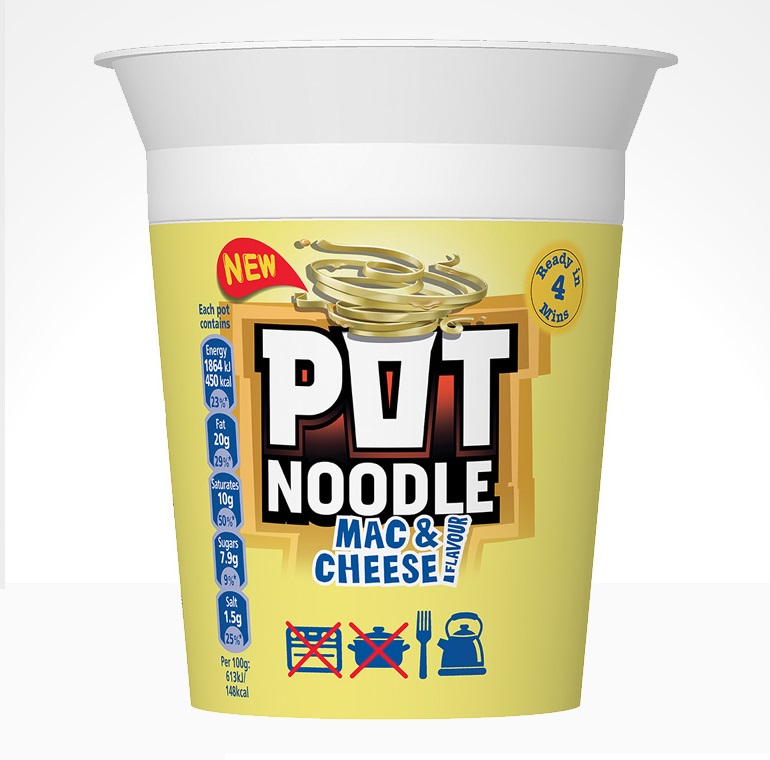
Find the location of `cup`. cup is located at coordinates click(377, 143).